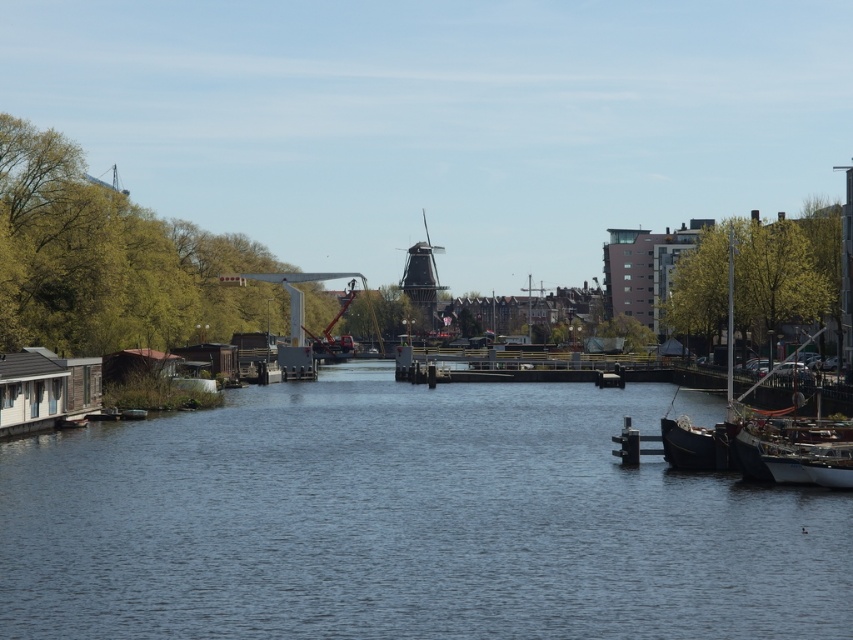
Question: Is the position of blue water at center less distant than that of dark brown wooden boat at right?

Choices:
 (A) no
 (B) yes

Answer: (B)

Question: Is blue water at center bigger than dark brown wooden boat at right?

Choices:
 (A) no
 (B) yes

Answer: (A)

Question: Does blue water at center appear on the right side of dark brown wooden boat at right?

Choices:
 (A) yes
 (B) no

Answer: (B)

Question: Which point is closer to the camera taking this photo?

Choices:
 (A) (677, 420)
 (B) (781, 580)

Answer: (B)